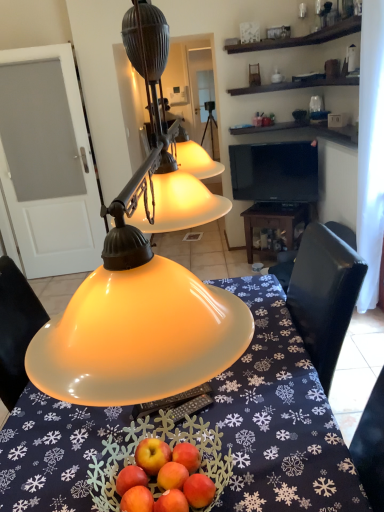
Question: Is black glossy tv at upper center thinner than wooden table at center?

Choices:
 (A) yes
 (B) no

Answer: (A)

Question: Considering the relative positions of black glossy tv at upper center and wooden table at center in the image provided, is black glossy tv at upper center behind wooden table at center?

Choices:
 (A) yes
 (B) no

Answer: (B)

Question: From the image's perspective, does black glossy tv at upper center appear higher than wooden table at center?

Choices:
 (A) yes
 (B) no

Answer: (A)

Question: Is black glossy tv at upper center taller than wooden table at center?

Choices:
 (A) yes
 (B) no

Answer: (A)

Question: Is black glossy tv at upper center to the right of wooden table at center from the viewer's perspective?

Choices:
 (A) yes
 (B) no

Answer: (B)

Question: Is black glossy tv at upper center oriented away from wooden table at center?

Choices:
 (A) yes
 (B) no

Answer: (B)

Question: Does black glossy tv at upper center have a lesser width compared to translucent glass bowl at center?

Choices:
 (A) yes
 (B) no

Answer: (A)

Question: Could you tell me if black glossy tv at upper center is facing translucent glass bowl at center?

Choices:
 (A) yes
 (B) no

Answer: (A)

Question: Is translucent glass bowl at center surrounded by black glossy tv at upper center?

Choices:
 (A) yes
 (B) no

Answer: (B)

Question: Considering the relative sizes of black glossy tv at upper center and translucent glass bowl at center in the image provided, is black glossy tv at upper center smaller than translucent glass bowl at center?

Choices:
 (A) no
 (B) yes

Answer: (B)

Question: Is black glossy tv at upper center looking in the opposite direction of translucent glass bowl at center?

Choices:
 (A) no
 (B) yes

Answer: (A)

Question: From the image's perspective, is black glossy tv at upper center under translucent glass bowl at center?

Choices:
 (A) yes
 (B) no

Answer: (B)

Question: Does wooden table at center have a greater height compared to matte yellow glass lampshade at center?

Choices:
 (A) no
 (B) yes

Answer: (A)